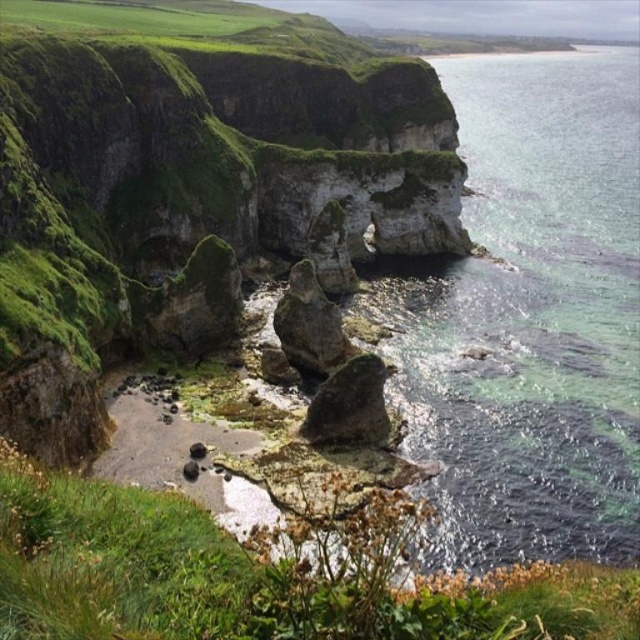
Does point (602, 141) come behind point (294, 285)?

Yes.

Where is `clear water at lower right`? This screenshot has width=640, height=640. clear water at lower right is located at coordinates (529, 316).

I want to click on clear water at lower right, so click(x=529, y=316).

Find the location of a particular element. This screenshot has height=640, width=640. clear water at lower right is located at coordinates (529, 316).

Is green mossy rock formation at center wider than rough textured rock at center?

Yes, green mossy rock formation at center is wider than rough textured rock at center.

Does point (106, 332) lie behind point (340, 353)?

That is False.

The width and height of the screenshot is (640, 640). In order to click on green mossy rock formation at center in this screenshot , I will do `click(186, 193)`.

Find the location of a particular element. Image resolution: width=640 pixels, height=640 pixels. green mossy rock formation at center is located at coordinates (x=186, y=193).

Is clear water at lower right to the right of dark gray rock at center from the viewer's perspective?

Indeed, clear water at lower right is positioned on the right side of dark gray rock at center.

The image size is (640, 640). Find the location of `clear water at lower right`. clear water at lower right is located at coordinates (529, 316).

What are the coordinates of `clear water at lower right` in the screenshot? It's located at (529, 316).

You are a GUI agent. You are given a task and a screenshot of the screen. Output one action in this format:
    pyautogui.click(x=<x>, y=<y>)
    Task: Click on the clear water at lower right
    
    Given the screenshot: What is the action you would take?
    pyautogui.click(x=529, y=316)